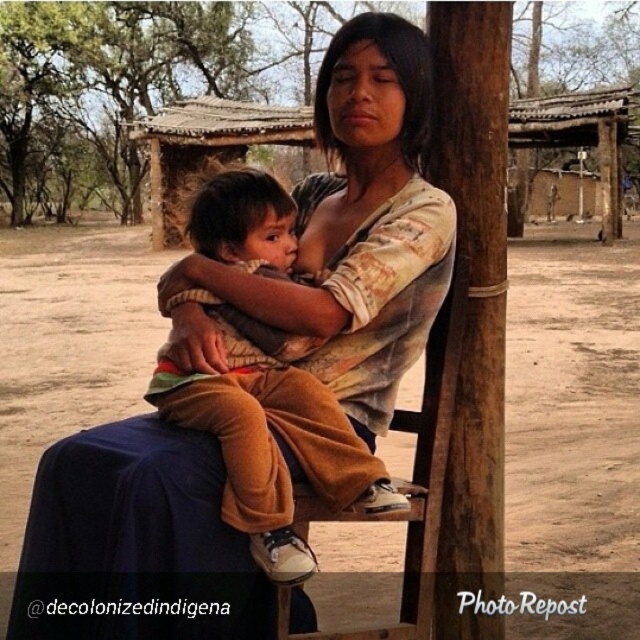
Question: Which is nearer to the green leafy tree at upper left?

Choices:
 (A) wooden chair at center
 (B) brown velvety pants at center
 (C) distressed cotton shirt at center

Answer: (C)

Question: Where is brown velvety pants at center located in relation to wooden chair at center in the image?

Choices:
 (A) above
 (B) below

Answer: (A)

Question: Which of the following is the closest to the observer?

Choices:
 (A) green leafy tree at upper left
 (B) distressed cotton shirt at center
 (C) wooden chair at center
 (D) brown velvety pants at center

Answer: (B)

Question: Which point is farther to the camera?

Choices:
 (A) green leafy tree at upper left
 (B) brown velvety pants at center
 (C) wooden chair at center
 (D) distressed cotton shirt at center

Answer: (A)

Question: Does distressed cotton shirt at center appear on the right side of green leafy tree at upper left?

Choices:
 (A) no
 (B) yes

Answer: (B)

Question: Is distressed cotton shirt at center smaller than brown velvety pants at center?

Choices:
 (A) no
 (B) yes

Answer: (A)